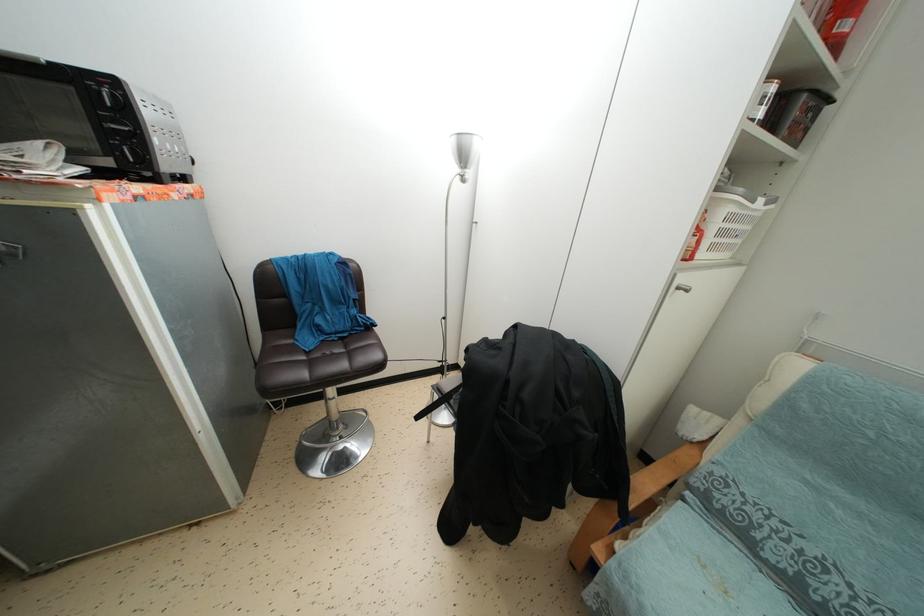
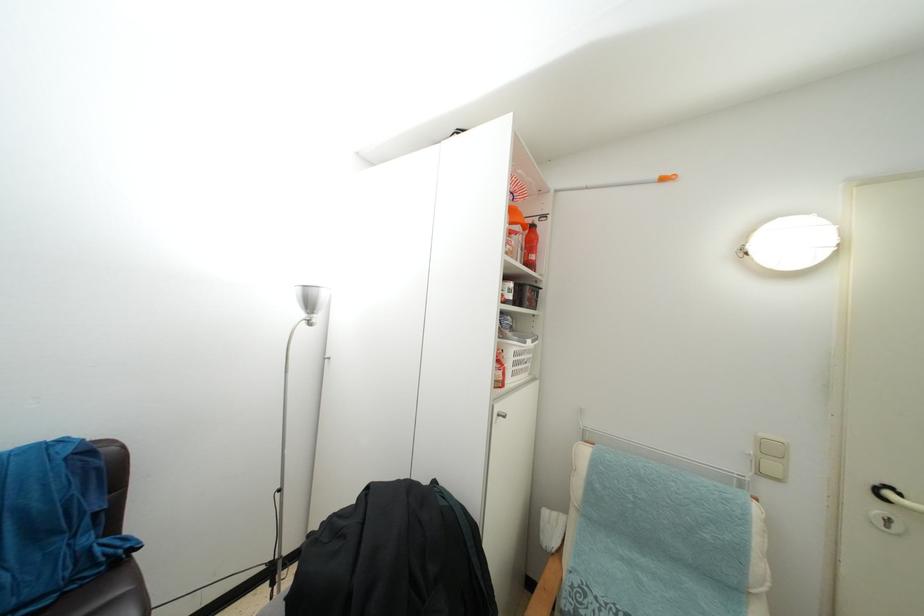
The point at [458,145] is marked in the first image. Where is the corresponding point in the second image?

(304, 294)